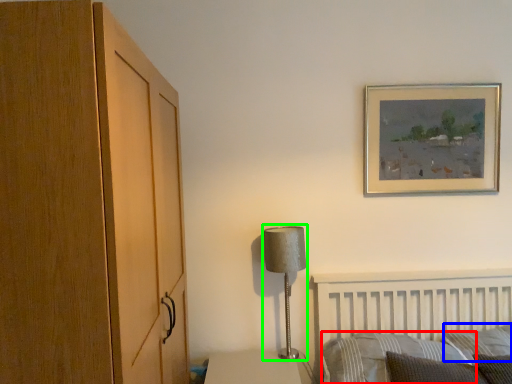
Question: Based on their relative distances, which object is farther from pillow (highlighted by a red box)? Choose from pillow (highlighted by a blue box) and table lamp (highlighted by a green box).

Choices:
 (A) pillow
 (B) table lamp

Answer: (B)